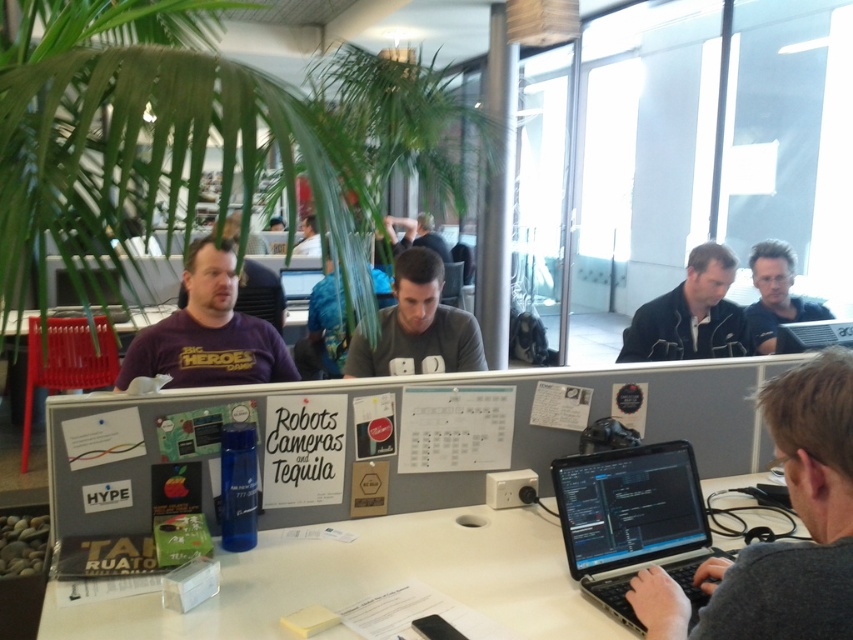
In the scene shown: Is purple t-shirt at center closer to the viewer compared to gray matte shirt at center?

Yes, purple t-shirt at center is closer to the viewer.

Who is lower down, purple t-shirt at center or gray matte shirt at center?

gray matte shirt at center is below.

Based on the photo, who is more forward, (206, 314) or (422, 292)?

Positioned in front is point (206, 314).

This screenshot has width=853, height=640. I want to click on purple t-shirt at center, so click(x=207, y=332).

Measure the distance from silver metallic laptop at center to gray matte shirt at center.

silver metallic laptop at center and gray matte shirt at center are 1.02 meters apart.

Is point (604, 604) more distant than point (372, 365)?

No, (604, 604) is closer to viewer.

Who is more forward, (587, 536) or (474, 369)?

Point (587, 536)

The width and height of the screenshot is (853, 640). In order to click on silver metallic laptop at center in this screenshot , I will do `click(631, 522)`.

Can you confirm if silver metallic laptop at center is taller than black plastic computer at right?

Correct, silver metallic laptop at center is much taller as black plastic computer at right.

The width and height of the screenshot is (853, 640). Identify the location of silver metallic laptop at center. (631, 522).